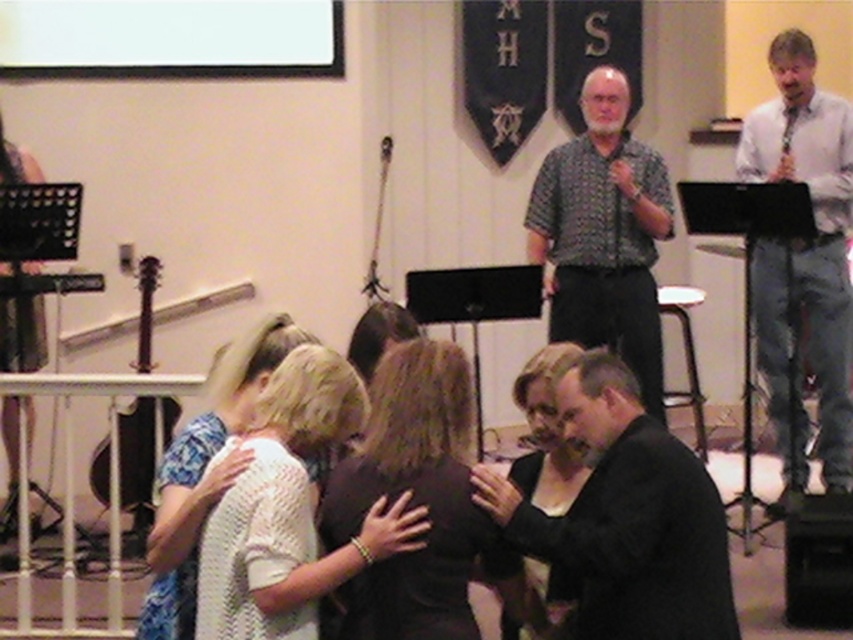
You are taking a photo of the scene and want to focus on both point (663, 540) and point (775, 129). Which point should you adjust your camera focus to first to ensure both are in focus?

Point (663, 540) is closer to the camera than point (775, 129). To ensure both are in focus, you should adjust your camera focus to point (663, 540) first, as it is closer and will set the focal plane appropriately for the farther point as well.

You are at a social event and want to know the distance between the dark brown fabric dress at center and the black matte dress at center. Can you estimate how far apart they are?

The dark brown fabric dress at center is 17.81 inches from the black matte dress at center.